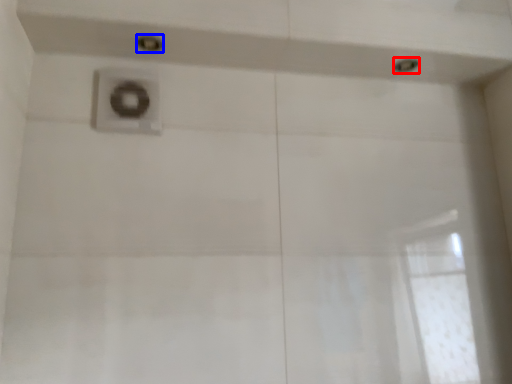
Question: Which of the following is the farthest to the observer, shower (highlighted by a red box) or shower (highlighted by a blue box)?

Choices:
 (A) shower
 (B) shower

Answer: (A)